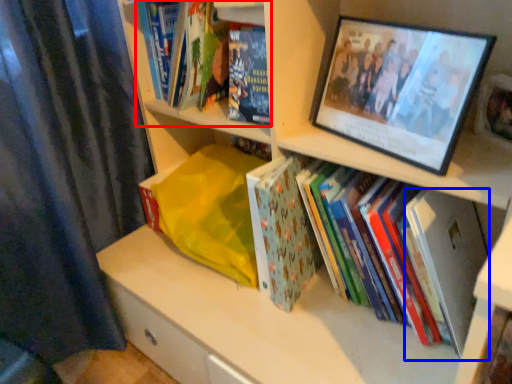
Question: Among these objects, which one is farthest to the camera, book (highlighted by a red box) or paperback book (highlighted by a blue box)?

Choices:
 (A) book
 (B) paperback book

Answer: (A)